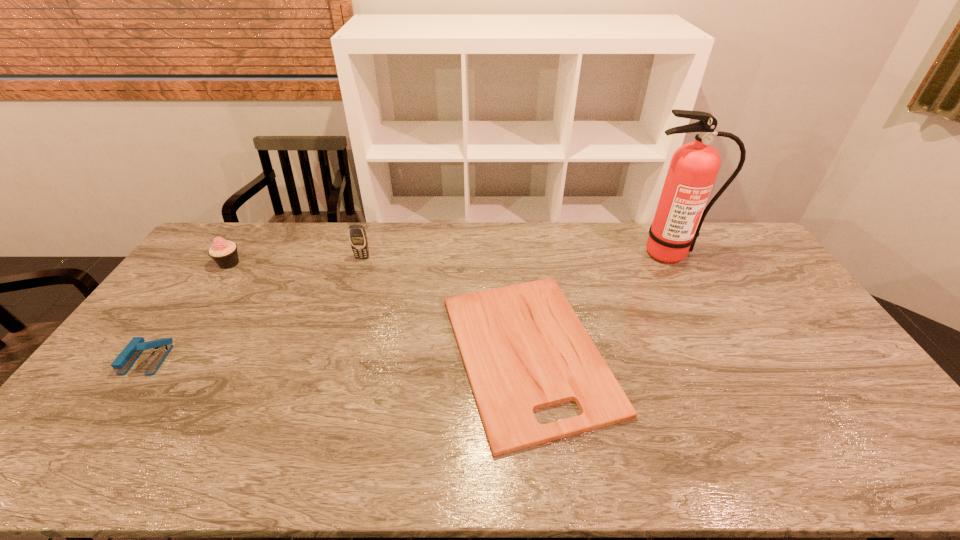
At what (x,y) coordinates should I click in order to perform the action: click on blank area at the far edge. Please return your answer as a coordinate pair (x, y). Looking at the image, I should click on (379, 242).

In the image, there is a desktop. At what (x,y) coordinates should I click in order to perform the action: click on free space at the near edge. Please return your answer as a coordinate pair (x, y). Looking at the image, I should click on (409, 446).

Locate an element on the screen. free space at the right edge of the desktop is located at coordinates (762, 269).

The width and height of the screenshot is (960, 540). In the image, there is a desktop. Identify the location of free space at the near right corner. (891, 453).

Locate an element on the screen. The height and width of the screenshot is (540, 960). free space between the fourth tallest object and the third tallest object is located at coordinates (188, 311).

The height and width of the screenshot is (540, 960). Find the location of `vacant region between the fire extinguisher and the cupcake`. vacant region between the fire extinguisher and the cupcake is located at coordinates (449, 258).

Image resolution: width=960 pixels, height=540 pixels. I want to click on free spot between the cellular telephone and the fourth tallest object, so click(x=254, y=308).

Locate an element on the screen. The image size is (960, 540). free space between the second tallest object and the tallest object is located at coordinates (516, 255).

Where is `vacant region between the fourth tallest object and the fire extinguisher`? The height and width of the screenshot is (540, 960). vacant region between the fourth tallest object and the fire extinguisher is located at coordinates (408, 306).

Locate an element on the screen. free space between the third object from left to right and the third shortest object is located at coordinates (296, 260).